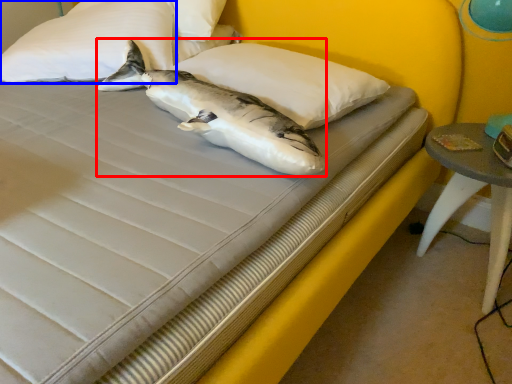
Question: Among these objects, which one is nearest to the camera, shark (highlighted by a red box) or pillow (highlighted by a blue box)?

Choices:
 (A) shark
 (B) pillow

Answer: (A)